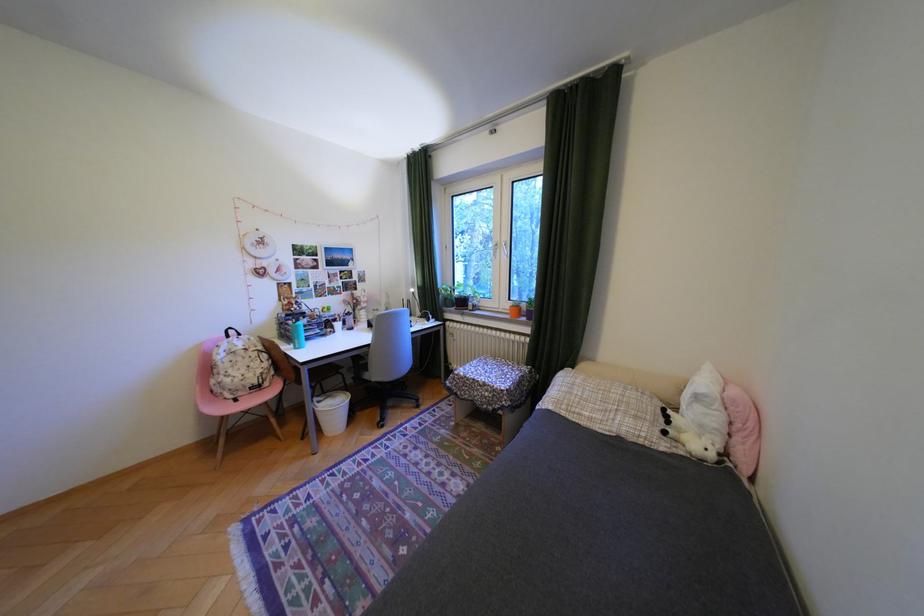
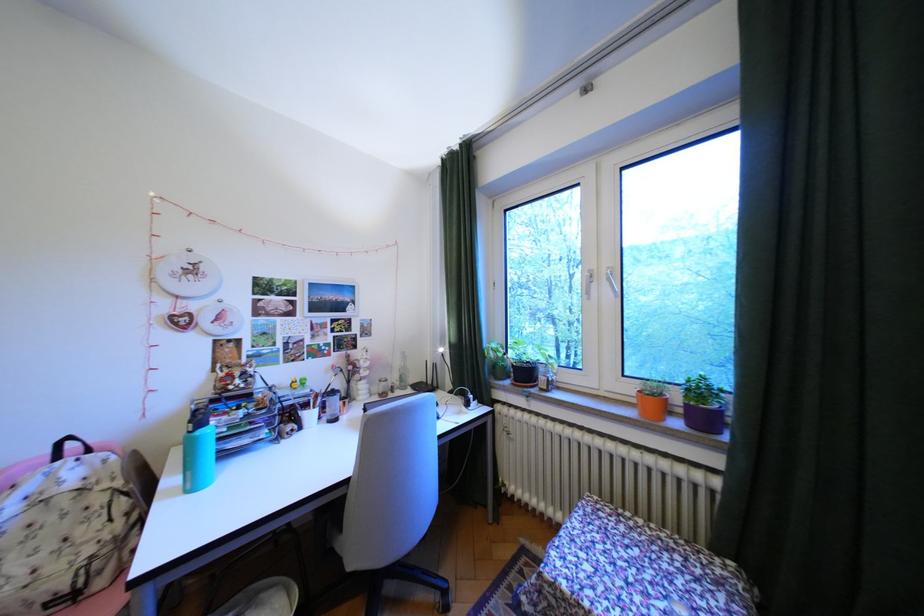
Where in the second image is the point corresponding to pixel 346 320 from the first image?

(318, 406)